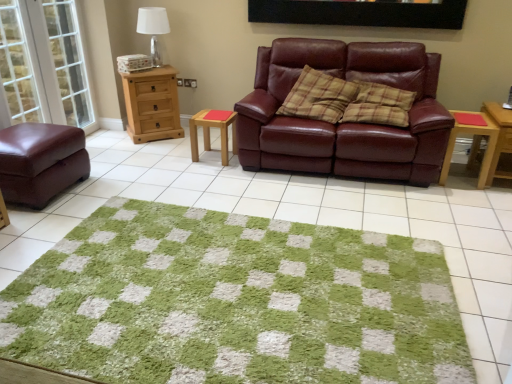
What do you see at coordinates (318, 97) in the screenshot?
I see `plaid fabric pillow at center, positioned as the 1th pillow in left-to-right order` at bounding box center [318, 97].

This screenshot has width=512, height=384. What do you see at coordinates (62, 58) in the screenshot?
I see `transparent glass door at left, placed as the 2th glass door when sorted from left to right` at bounding box center [62, 58].

Measure the distance between transparent glass door at left, placed as the 2th glass door when sorted from left to right, and camera.

A distance of 3.53 meters exists between transparent glass door at left, placed as the 2th glass door when sorted from left to right, and camera.

The image size is (512, 384). What are the coordinates of `shiny brown leather couch at center` in the screenshot? It's located at (345, 123).

The width and height of the screenshot is (512, 384). I want to click on white fabric lampshade at upper left, so click(154, 30).

Locate an element on the screen. plaid fabric pillow at center, the second pillow from the right is located at coordinates coord(318,97).

Does plaid fabric pillow at center, positioned as the second pillow in left-to-right order, turn towards clear glass door at left, the 2th glass door in the right-to-left sequence?

No.

Which of these two, plaid fabric pillow at center, positioned as the second pillow in left-to-right order, or clear glass door at left, which appears as the first glass door when viewed from the left, is smaller?

With smaller size is clear glass door at left, which appears as the first glass door when viewed from the left.

Which object is positioned more to the left, plaid fabric pillow at center, the first pillow positioned from the right, or clear glass door at left, which appears as the first glass door when viewed from the left?

From the viewer's perspective, clear glass door at left, which appears as the first glass door when viewed from the left, appears more on the left side.

Which of these two, wooden stool at center, which is the 3th table in right-to-left order, or natural wood chest of drawers at left, stands taller?

natural wood chest of drawers at left.

From a real-world perspective, who is located lower, wooden stool at center, placed as the first table when sorted from left to right, or natural wood chest of drawers at left?

wooden stool at center, placed as the first table when sorted from left to right, is physically lower.

How different are the orientations of wooden stool at center, placed as the first table when sorted from left to right, and natural wood chest of drawers at left in degrees?

40.9 degrees.

Is wooden stool at center, placed as the first table when sorted from left to right, bigger than natural wood chest of drawers at left?

No, wooden stool at center, placed as the first table when sorted from left to right, is not bigger than natural wood chest of drawers at left.

Which of these two, plaid fabric pillow at center, the first pillow positioned from the right, or shiny brown leather couch at center, is bigger?

shiny brown leather couch at center is bigger.

Considering the relative sizes of plaid fabric pillow at center, positioned as the second pillow in left-to-right order, and shiny brown leather couch at center in the image provided, is plaid fabric pillow at center, positioned as the second pillow in left-to-right order, thinner than shiny brown leather couch at center?

Yes, plaid fabric pillow at center, positioned as the second pillow in left-to-right order, is thinner than shiny brown leather couch at center.

Is point (369, 110) positioned behind point (415, 106)?

That is False.

Looking at this image, from a real-world perspective, is wooden side table at right, which ranks as the second table in right-to-left order, positioned above or below clear glass door at left, the 2th glass door in the right-to-left sequence?

wooden side table at right, which ranks as the second table in right-to-left order, is situated lower than clear glass door at left, the 2th glass door in the right-to-left sequence, in the real world.

Considering the sizes of objects wooden side table at right, which ranks as the second table in right-to-left order, and clear glass door at left, the 2th glass door in the right-to-left sequence, in the image provided, who is thinner, wooden side table at right, which ranks as the second table in right-to-left order, or clear glass door at left, the 2th glass door in the right-to-left sequence,?

Thinner between the two is clear glass door at left, the 2th glass door in the right-to-left sequence.

Is wooden side table at right, the second table from the left, positioned far away from clear glass door at left, the 2th glass door in the right-to-left sequence?

Indeed, wooden side table at right, the second table from the left, is not near clear glass door at left, the 2th glass door in the right-to-left sequence.

Between shiny brown leather couch at center and black matte picture frame at upper center, which one has larger width?

Wider between the two is shiny brown leather couch at center.

From the image's perspective, which object appears higher, shiny brown leather couch at center or black matte picture frame at upper center?

From the image's view, black matte picture frame at upper center is above.

Does point (500, 116) lie behind point (345, 256)?

Yes, it is behind point (345, 256).

Considering the relative sizes of wooden table at right, arranged as the 3th table when viewed from the left, and green shaggy rug at center in the image provided, is wooden table at right, arranged as the 3th table when viewed from the left, wider than green shaggy rug at center?

No, wooden table at right, arranged as the 3th table when viewed from the left, is not wider than green shaggy rug at center.

Does wooden table at right, the first table viewed from the right, have a smaller size compared to green shaggy rug at center?

Correct, wooden table at right, the first table viewed from the right, occupies less space than green shaggy rug at center.

From the picture: Can you tell me how much wooden table at right, the first table viewed from the right, and green shaggy rug at center differ in facing direction?

1.53 degrees.

Is black matte picture frame at upper center thinner than shiny brown leather couch at center?

Yes, black matte picture frame at upper center is thinner than shiny brown leather couch at center.

What's the angular difference between black matte picture frame at upper center and shiny brown leather couch at center's facing directions?

They differ by 2.4 degrees in their facing directions.

Can you confirm if black matte picture frame at upper center is smaller than shiny brown leather couch at center?

Yes.

From the picture: Between black matte picture frame at upper center and shiny brown leather couch at center, which one appears on the left side from the viewer's perspective?

shiny brown leather couch at center.

Identify the location of the 1st glass door positioned above the plaid fabric pillow at center, positioned as the second pillow in left-to-right order (from the image's perspective). Image resolution: width=512 pixels, height=384 pixels. (20, 66).

Where is `the 1st table in front of the natural wood chest of drawers at left, starting your count from the anchor`? the 1st table in front of the natural wood chest of drawers at left, starting your count from the anchor is located at coordinates (209, 132).

Which object lies nearer to the anchor point wooden stool at center, placed as the first table when sorted from left to right, white fabric lampshade at upper left or shiny brown leather couch at center?

shiny brown leather couch at center.

When comparing their distances from plaid fabric pillow at center, the second pillow from the right, does black matte picture frame at upper center or shiny brown leather couch at center seem further?

Based on the image, black matte picture frame at upper center appears to be further to plaid fabric pillow at center, the second pillow from the right.

From the picture: Based on their spatial positions, is white fabric lampshade at upper left or black matte picture frame at upper center further from transparent glass door at left, the 1th glass door in the right-to-left sequence?

black matte picture frame at upper center lies further to transparent glass door at left, the 1th glass door in the right-to-left sequence, than the other object.

When comparing their distances from plaid fabric pillow at center, positioned as the 1th pillow in left-to-right order, does black matte picture frame at upper center or white fabric lampshade at upper left seem further?

Based on the image, white fabric lampshade at upper left appears to be further to plaid fabric pillow at center, positioned as the 1th pillow in left-to-right order.

Considering their positions, is shiny brown leather couch at center positioned closer to plaid fabric pillow at center, the second pillow from the right, than burgundy leather ottoman at left?

The object closer to plaid fabric pillow at center, the second pillow from the right, is shiny brown leather couch at center.

Based on their spatial positions, is wooden table at right, the first table viewed from the right, or white fabric lampshade at upper left further from transparent glass door at left, the 1th glass door in the right-to-left sequence?

The object further to transparent glass door at left, the 1th glass door in the right-to-left sequence, is wooden table at right, the first table viewed from the right.

Considering their positions, is wooden stool at center, placed as the first table when sorted from left to right, positioned closer to natural wood chest of drawers at left than shiny brown leather couch at center?

wooden stool at center, placed as the first table when sorted from left to right, is closer to natural wood chest of drawers at left.

Looking at this image, looking at the image, which one is located closer to white fabric lampshade at upper left, black matte picture frame at upper center or wooden side table at right, which ranks as the second table in right-to-left order?

black matte picture frame at upper center.

I want to click on picture frame between burgundy leather ottoman at left and plaid fabric pillow at center, positioned as the second pillow in left-to-right order, from left to right, so click(361, 13).

The width and height of the screenshot is (512, 384). I want to click on studio couch located between wooden stool at center, placed as the first table when sorted from left to right, and plaid fabric pillow at center, the first pillow positioned from the right, in the left-right direction, so click(x=345, y=123).

I want to click on table lamp situated between clear glass door at left, which appears as the first glass door when viewed from the left, and wooden side table at right, which ranks as the second table in right-to-left order, from left to right, so click(154, 30).

Find the location of `table between natural wood chest of drawers at left and plaid fabric pillow at center, positioned as the second pillow in left-to-right order`. table between natural wood chest of drawers at left and plaid fabric pillow at center, positioned as the second pillow in left-to-right order is located at coordinates (209, 132).